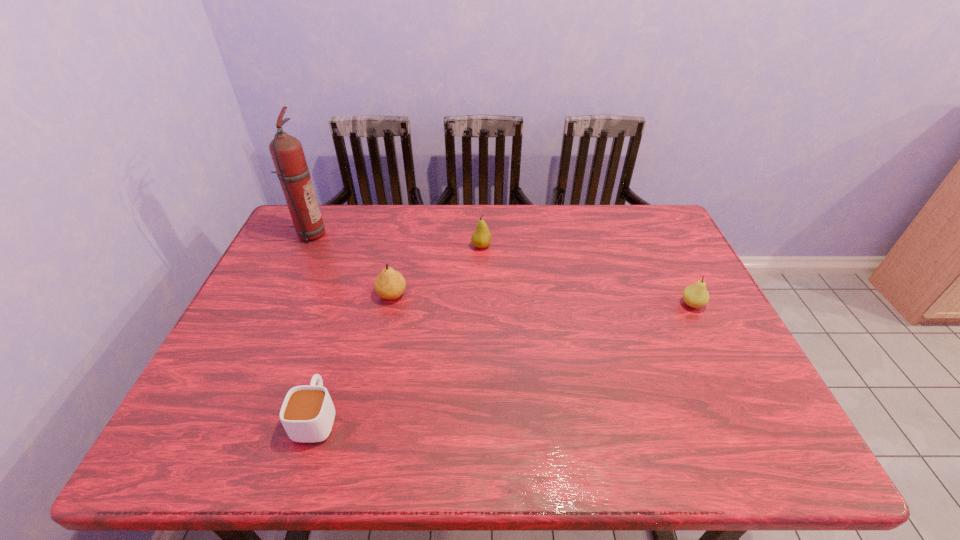
Identify the location of free space located on the front of the second pear from left to right. (481, 272).

Image resolution: width=960 pixels, height=540 pixels. In order to click on vacant region located on the back of the third object from left to right in this screenshot , I will do `click(396, 273)`.

In order to click on vacant area situated 0.230m on the front of the rightmost object in this screenshot , I will do `click(733, 387)`.

Locate an element on the screen. vacant space located 0.210m on the side with the handle of the second object from left to right is located at coordinates (346, 321).

I want to click on free region located on the side with the handle of the second object from left to right, so click(x=348, y=316).

What are the coordinates of `free region located on the side with the handle of the second object from left to right` in the screenshot? It's located at (346, 321).

This screenshot has width=960, height=540. What are the coordinates of `fire extinguisher at the far edge` in the screenshot? It's located at (286, 151).

Image resolution: width=960 pixels, height=540 pixels. I want to click on pear present at the far edge, so click(481, 238).

Image resolution: width=960 pixels, height=540 pixels. I want to click on object positioned at the near edge, so click(307, 414).

Identify the location of object that is at the left edge. This screenshot has height=540, width=960. (286, 151).